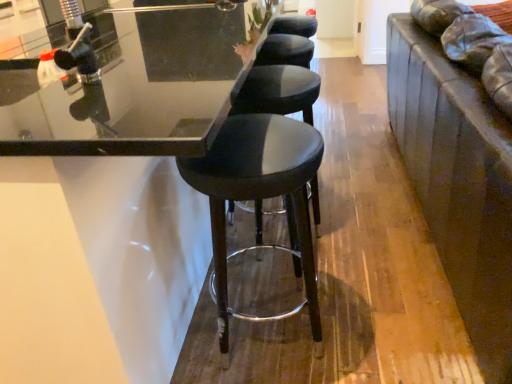
Locate an element on the screen. This screenshot has width=512, height=384. vacant region to the right of black leather stool at center, which is the first stool from front to back is located at coordinates (368, 317).